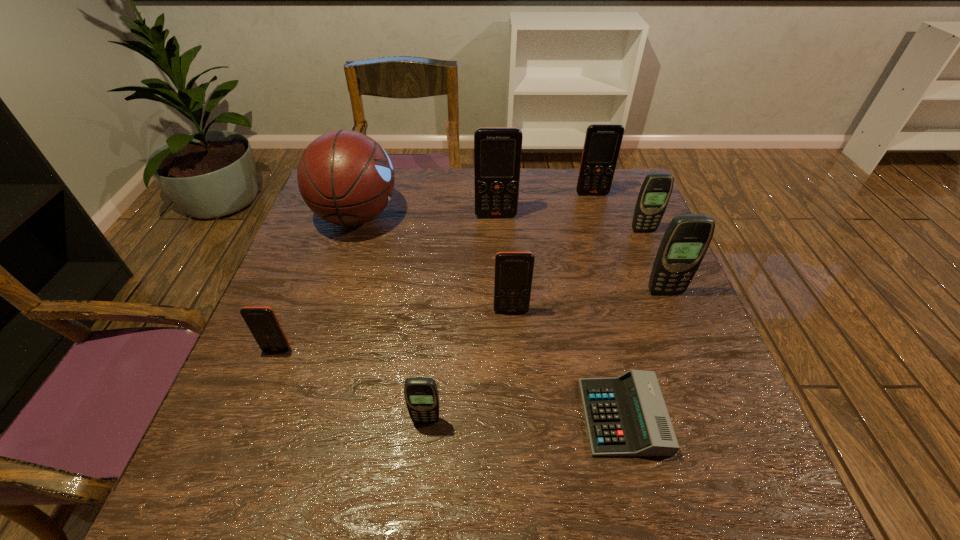
This screenshot has width=960, height=540. In order to click on free space located on the screen of the fourth nearest cellular telephone in this screenshot , I will do coord(695,367).

You are a GUI agent. You are given a task and a screenshot of the screen. Output one action in this format:
    pyautogui.click(x=<x>, y=<y>)
    Task: Click on the free location located 0.070m on the screen of the third farthest cellular telephone
    The width and height of the screenshot is (960, 540).
    Given the screenshot: What is the action you would take?
    pyautogui.click(x=651, y=249)

Locate an element on the screen. Image resolution: width=960 pixels, height=540 pixels. vacant space located 0.090m on the screen of the fifth farthest cellular telephone is located at coordinates (514, 347).

Identify the location of vacant space situated 0.100m on the screen of the nearest orange cellular telephone. This screenshot has width=960, height=540. pyautogui.click(x=259, y=395).

Find the location of `vacant region located 0.080m on the screen of the seventh object from right to left`. vacant region located 0.080m on the screen of the seventh object from right to left is located at coordinates (421, 467).

Find the location of a particular element. The image size is (960, 540). free location located 0.090m on the left of the gray calculator is located at coordinates coord(537,416).

Where is `basketball at the far edge`? This screenshot has width=960, height=540. basketball at the far edge is located at coordinates (345, 177).

At what (x,y) coordinates should I click in order to perform the action: click on object located at the near edge. Please return your answer as a coordinate pair (x, y). This screenshot has width=960, height=540. Looking at the image, I should click on (626, 415).

You are a GUI agent. You are given a task and a screenshot of the screen. Output one action in this format:
    pyautogui.click(x=<x>, y=<y>)
    Task: Click on the basketball that is positioned at the left edge
    
    Given the screenshot: What is the action you would take?
    pyautogui.click(x=345, y=177)

What are the coordinates of `cellular telephone present at the left edge` in the screenshot? It's located at (262, 322).